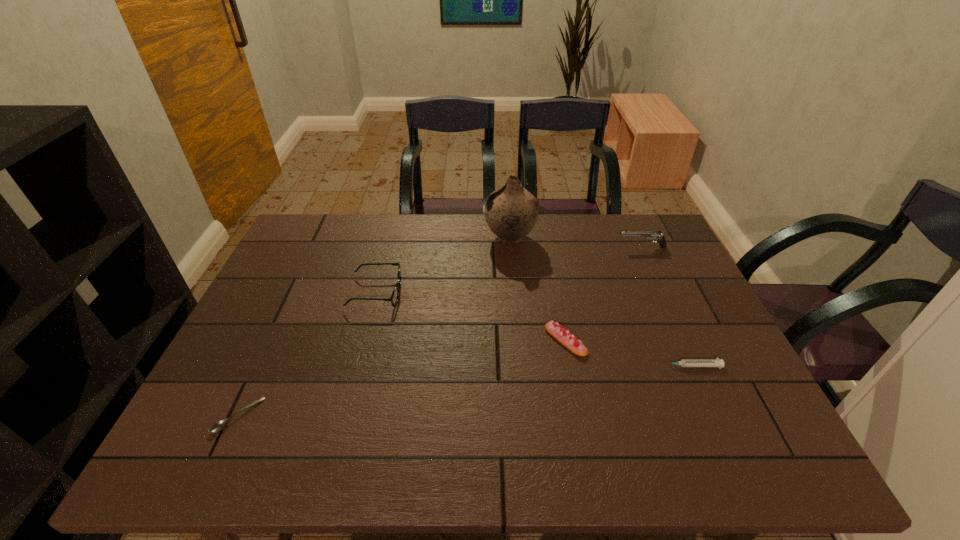
The width and height of the screenshot is (960, 540). I want to click on vacant region that satisfies the following two spatial constraints: 1. on the back side of the eclair; 2. on the front-facing side of the second object from left to right, so click(557, 293).

Where is `vacant region that satisfies the following two spatial constraints: 1. from the spout of the third nearest object; 2. on the left side of the tallest object`? The width and height of the screenshot is (960, 540). vacant region that satisfies the following two spatial constraints: 1. from the spout of the third nearest object; 2. on the left side of the tallest object is located at coordinates (519, 340).